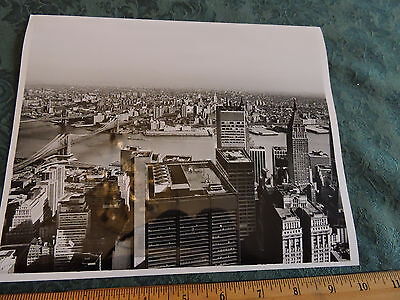
At what (x,y) coordinates should I click in order to perform the action: click on 1 back and white photo. Please return your answer as a coordinate pair (x, y). Image resolution: width=400 pixels, height=300 pixels. Looking at the image, I should click on (140, 224).